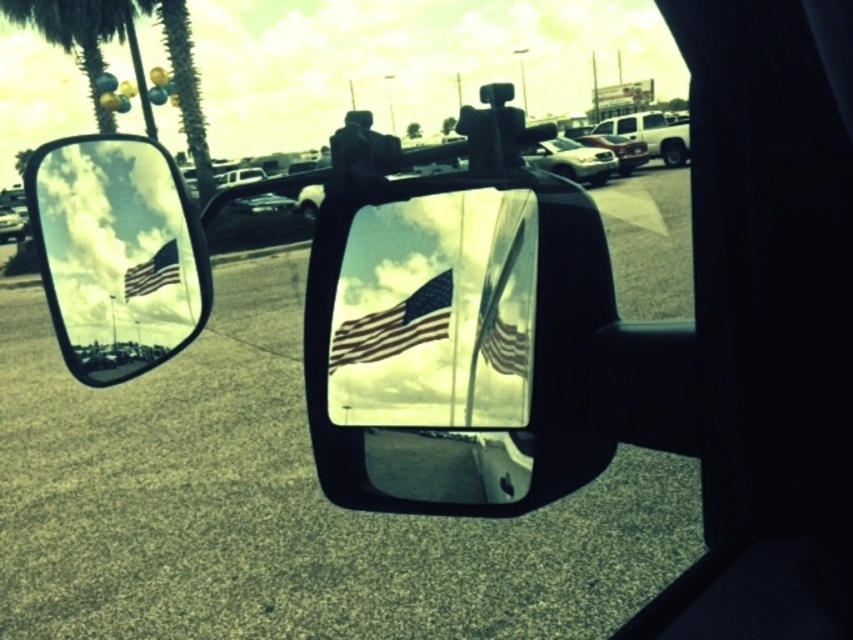
From the picture: Is reflective glass mirror at left bigger than white matte truck at upper right?

Actually, reflective glass mirror at left might be smaller than white matte truck at upper right.

Does point (149, 292) lie in front of point (679, 150)?

Yes, point (149, 292) is in front of point (679, 150).

Find the location of a particular element. This screenshot has width=853, height=640. reflective glass mirror at left is located at coordinates (115, 253).

Which is below, shiny silver car at center or metallic silver car at left?

shiny silver car at center is lower down.

Find the location of `shiny silver car at center`. shiny silver car at center is located at coordinates (264, 204).

Is point (264, 198) in front of point (1, 211)?

That is True.

Image resolution: width=853 pixels, height=640 pixels. I want to click on shiny silver car at center, so click(x=264, y=204).

Is american flag at left further to camera compared to shiny silver car at center?

Yes.

Who is higher up, american flag at left or shiny silver car at center?

shiny silver car at center is higher up.

Describe the element at coordinates (154, 272) in the screenshot. I see `american flag at left` at that location.

The width and height of the screenshot is (853, 640). Identify the location of american flag at left. (154, 272).